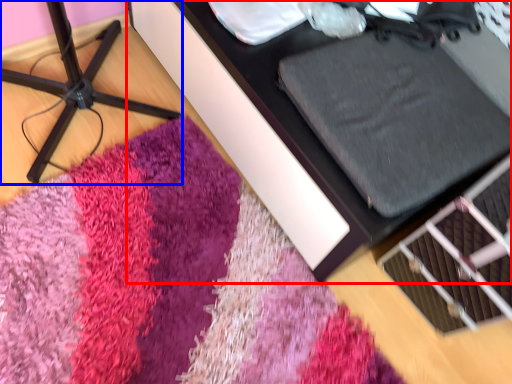
Question: Which point is further to the camera, furniture (highlighted by a red box) or furniture (highlighted by a blue box)?

Choices:
 (A) furniture
 (B) furniture

Answer: (A)